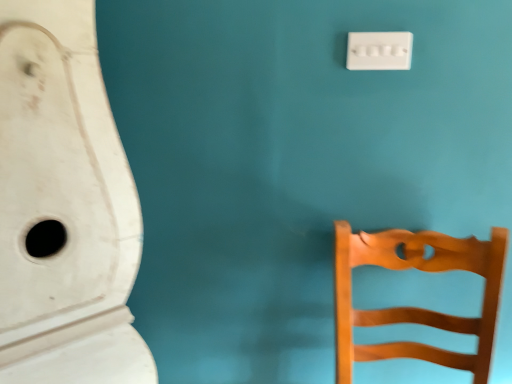
Question: From a real-world perspective, is white plastic light switch at upper right over wooden chair at right?

Choices:
 (A) no
 (B) yes

Answer: (B)

Question: Is white plastic light switch at upper right placed right next to wooden chair at right?

Choices:
 (A) yes
 (B) no

Answer: (B)

Question: Is white plastic light switch at upper right outside of wooden chair at right?

Choices:
 (A) no
 (B) yes

Answer: (B)

Question: From the image's perspective, does white plastic light switch at upper right appear higher than wooden chair at right?

Choices:
 (A) yes
 (B) no

Answer: (A)

Question: Is white plastic light switch at upper right taller than wooden chair at right?

Choices:
 (A) no
 (B) yes

Answer: (A)

Question: Considering the positions of white plastic light switch at upper right and wooden chair at right in the image, is white plastic light switch at upper right wider or thinner than wooden chair at right?

Choices:
 (A) thin
 (B) wide

Answer: (A)

Question: Would you say white plastic light switch at upper right is inside or outside wooden chair at right?

Choices:
 (A) inside
 (B) outside

Answer: (B)

Question: Considering the positions of white plastic light switch at upper right and wooden chair at right in the image, is white plastic light switch at upper right bigger or smaller than wooden chair at right?

Choices:
 (A) big
 (B) small

Answer: (B)

Question: Is point (386, 56) closer or farther from the camera than point (483, 360)?

Choices:
 (A) closer
 (B) farther

Answer: (A)

Question: Is point (384, 34) positioned closer to the camera than point (19, 211)?

Choices:
 (A) closer
 (B) farther

Answer: (B)

Question: Considering the positions of white plastic light switch at upper right and white matte urinal at left in the image, is white plastic light switch at upper right bigger or smaller than white matte urinal at left?

Choices:
 (A) small
 (B) big

Answer: (A)

Question: Considering their positions, is white plastic light switch at upper right located in front of or behind white matte urinal at left?

Choices:
 (A) behind
 (B) front

Answer: (A)

Question: Do you think white plastic light switch at upper right is within white matte urinal at left, or outside of it?

Choices:
 (A) outside
 (B) inside

Answer: (A)

Question: From a real-world perspective, relative to white matte urinal at left, is wooden chair at right vertically above or below?

Choices:
 (A) below
 (B) above

Answer: (A)

Question: Is wooden chair at right in front of or behind white matte urinal at left in the image?

Choices:
 (A) behind
 (B) front

Answer: (A)